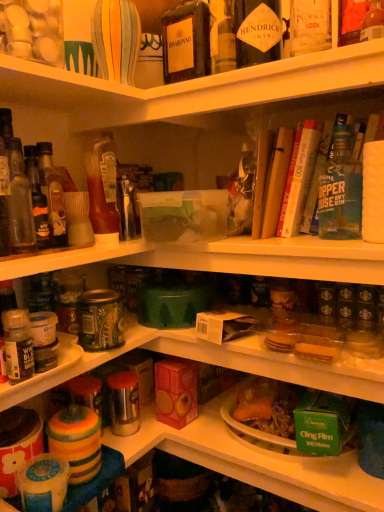
In order to face striped ceramic jar at lower left, should I rotate leftwards or rightwards?

You should rotate left by 15.316 degrees.

Where is `green matte bottle at upper right, marked as the 7th bottle in a left-to-right arrangement`? This screenshot has width=384, height=512. green matte bottle at upper right, marked as the 7th bottle in a left-to-right arrangement is located at coordinates (340, 188).

The height and width of the screenshot is (512, 384). What do you see at coordinates (340, 188) in the screenshot?
I see `green matte bottle at upper right, marked as the 7th bottle in a left-to-right arrangement` at bounding box center [340, 188].

Describe the element at coordinates (276, 181) in the screenshot. The height and width of the screenshot is (512, 384). I see `yellow paperback book at upper right, positioned as the first book in left-to-right order` at that location.

This screenshot has width=384, height=512. In order to click on soy sauce glass at left, the fourth bottle when ordered from left to right in this screenshot , I will do `click(52, 194)`.

What do you see at coordinates (37, 198) in the screenshot?
I see `matte glass bottle at left, acting as the 6th bottle starting from the right` at bounding box center [37, 198].

Locate an element on the screen. The height and width of the screenshot is (512, 384). striped ceramic jar at lower left is located at coordinates (76, 441).

From a real-world perspective, is clear plastic container at upper center, acting as the first shelf starting from the right, located higher than hardcover book at upper right, the 2th book in the right-to-left sequence?

Indeed, from a real-world perspective, clear plastic container at upper center, acting as the first shelf starting from the right, stands above hardcover book at upper right, the 2th book in the right-to-left sequence.

Is clear plastic container at upper center, which is the 1th shelf in top-to-bottom order, oriented away from hardcover book at upper right, the 2th book in the right-to-left sequence?

No, hardcover book at upper right, the 2th book in the right-to-left sequence, is not at the back of clear plastic container at upper center, which is the 1th shelf in top-to-bottom order.

Considering the positions of objects clear plastic container at upper center, which is the 1th shelf in top-to-bottom order, and hardcover book at upper right, the 2th book in the right-to-left sequence, in the image provided, who is more to the left, clear plastic container at upper center, which is the 1th shelf in top-to-bottom order, or hardcover book at upper right, the 2th book in the right-to-left sequence,?

From the viewer's perspective, clear plastic container at upper center, which is the 1th shelf in top-to-bottom order, appears more on the left side.

What are the coordinates of `the 2nd book below the clear plastic container at upper center, marked as the second shelf in a left-to-right arrangement (from the image's perspective)` in the screenshot? It's located at (299, 177).

From the picture: Is the position of translucent glass bottle at upper left, the fifth bottle positioned from the left, more distant than that of clear plastic container at upper center, which is the 1th shelf in top-to-bottom order?

Yes, the depth of translucent glass bottle at upper left, the fifth bottle positioned from the left, is greater than that of clear plastic container at upper center, which is the 1th shelf in top-to-bottom order.

From the image's perspective, is translucent glass bottle at upper left, the fifth bottle positioned from the left, on clear plastic container at upper center, which is the 1th shelf in top-to-bottom order?

No.

What's the angular difference between translucent glass bottle at upper left, the 3th bottle in the right-to-left sequence, and clear plastic container at upper center, which is the 1th shelf in top-to-bottom order,'s facing directions?

There is a 91.4-degree angle between the facing directions of translucent glass bottle at upper left, the 3th bottle in the right-to-left sequence, and clear plastic container at upper center, which is the 1th shelf in top-to-bottom order.

Does translucent glass bottle at upper left, the 3th bottle in the right-to-left sequence, have a lesser width compared to clear plastic container at upper center, acting as the first shelf starting from the right?

Yes.

Considering the points (199, 39) and (302, 176), which point is behind, point (199, 39) or point (302, 176)?

Point (199, 39)

Does dark brown glass bottle at upper center, which appears as the 6th bottle when viewed from the left, turn towards hardcover book at upper right, arranged as the 2th book when viewed from the left?

No, dark brown glass bottle at upper center, which appears as the 6th bottle when viewed from the left, is not facing towards hardcover book at upper right, arranged as the 2th book when viewed from the left.

This screenshot has width=384, height=512. I want to click on bottle that appears above the hardcover book at upper right, the 2th book in the right-to-left sequence (from the image's perspective), so click(186, 41).

From the image's perspective, which is below, dark brown glass bottle at upper center, which ranks as the second bottle in right-to-left order, or matte glass bottle at left, the 2th bottle viewed from the left?

matte glass bottle at left, the 2th bottle viewed from the left, is shown below in the image.

Is dark brown glass bottle at upper center, which appears as the 6th bottle when viewed from the left, outside of matte glass bottle at left, the 2th bottle viewed from the left?

That's correct, dark brown glass bottle at upper center, which appears as the 6th bottle when viewed from the left, is outside of matte glass bottle at left, the 2th bottle viewed from the left.

At what (x,y) coordinates should I click in order to perform the action: click on the 5th bottle positioned below the dark brown glass bottle at upper center, which ranks as the second bottle in right-to-left order (from a real-world perspective). Please return your answer as a coordinate pair (x, y). The height and width of the screenshot is (512, 384). Looking at the image, I should click on pyautogui.click(x=37, y=198).

Between point (76, 341) and point (344, 208), which one is positioned behind?

Point (76, 341)

Consider the image. Can you confirm if metallic silver canister at left, the 2th shelf viewed from the top, is smaller than green matte bottle at upper right, the 1th bottle viewed from the right?

No, metallic silver canister at left, the 2th shelf viewed from the top, is not smaller than green matte bottle at upper right, the 1th bottle viewed from the right.

The width and height of the screenshot is (384, 512). Find the location of `the 6th bottle located above the metallic silver canister at left, acting as the 1th shelf starting from the left (from a real-world perspective)`. the 6th bottle located above the metallic silver canister at left, acting as the 1th shelf starting from the left (from a real-world perspective) is located at coordinates (340, 188).

From the image's perspective, is matte glass bottle at left, the 2th bottle viewed from the left, below striped ceramic jar at lower left?

No, from the image's perspective, matte glass bottle at left, the 2th bottle viewed from the left, is not below striped ceramic jar at lower left.

Does matte glass bottle at left, the 2th bottle viewed from the left, have a greater width compared to striped ceramic jar at lower left?

No.

From a real-world perspective, is matte glass bottle at left, the 2th bottle viewed from the left, positioned above or below striped ceramic jar at lower left?

matte glass bottle at left, the 2th bottle viewed from the left, is above striped ceramic jar at lower left.

Can you confirm if matte glass bottle at left, the 2th bottle viewed from the left, is smaller than striped ceramic jar at lower left?

Yes.

Is green matte bottle at upper right, marked as the 7th bottle in a left-to-right arrangement, taller or shorter than dark brown glass bottle at upper center, which appears as the 6th bottle when viewed from the left?

Clearly, green matte bottle at upper right, marked as the 7th bottle in a left-to-right arrangement, is shorter compared to dark brown glass bottle at upper center, which appears as the 6th bottle when viewed from the left.

From the image's perspective, is green matte bottle at upper right, the 1th bottle viewed from the right, on dark brown glass bottle at upper center, which ranks as the second bottle in right-to-left order?

No, from the image's perspective, green matte bottle at upper right, the 1th bottle viewed from the right, is not on top of dark brown glass bottle at upper center, which ranks as the second bottle in right-to-left order.

Is there a large distance between green matte bottle at upper right, marked as the 7th bottle in a left-to-right arrangement, and dark brown glass bottle at upper center, which ranks as the second bottle in right-to-left order?

That's not correct — green matte bottle at upper right, marked as the 7th bottle in a left-to-right arrangement, is a little close to dark brown glass bottle at upper center, which ranks as the second bottle in right-to-left order.

Does green matte bottle at upper right, the 1th bottle viewed from the right, lie in front of dark brown glass bottle at upper center, which appears as the 6th bottle when viewed from the left?

Yes, it is in front of dark brown glass bottle at upper center, which appears as the 6th bottle when viewed from the left.

Where is `the 2nd book behind the clear plastic container at upper center, marked as the second shelf in a left-to-right arrangement, counting from the anchor's position`? The image size is (384, 512). the 2nd book behind the clear plastic container at upper center, marked as the second shelf in a left-to-right arrangement, counting from the anchor's position is located at coordinates (299, 177).

This screenshot has height=512, width=384. I want to click on shelf that appears above the translucent glass bottle at upper left, the fifth bottle positioned from the left (from the image's perspective), so click(192, 86).

Looking at the image, which one is located further to dark brown glass bottle at upper center, which appears as the 6th bottle when viewed from the left, green matte bottle at upper right, the 1th bottle viewed from the right, or translucent glass bottle at left, the 7th bottle from the right?

translucent glass bottle at left, the 7th bottle from the right, lies further to dark brown glass bottle at upper center, which appears as the 6th bottle when viewed from the left, than the other object.

Estimate the real-world distances between objects in this image. Which object is closer to translucent glass bottle at left, the 7th bottle from the right, dark brown glass bottle at upper center, which ranks as the second bottle in right-to-left order, or striped ceramic jar at lower left?

Among the two, striped ceramic jar at lower left is located nearer to translucent glass bottle at left, the 7th bottle from the right.

From the image, which object appears to be nearer to translucent glass bottle at left, the 1th bottle in the left-to-right sequence, hardcover book at upper right, arranged as the 2th book when viewed from the left, or translucent plastic bottle at lower left, placed as the fifth bottle when sorted from right to left?

Among the two, translucent plastic bottle at lower left, placed as the fifth bottle when sorted from right to left, is located nearer to translucent glass bottle at left, the 1th bottle in the left-to-right sequence.

Which object lies nearer to the anchor point dark brown glass bottle at upper center, which appears as the 6th bottle when viewed from the left, hardcover book at upper right, placed as the first book when sorted from right to left, or matte glass bottle at left, acting as the 6th bottle starting from the right?

The object closer to dark brown glass bottle at upper center, which appears as the 6th bottle when viewed from the left, is hardcover book at upper right, placed as the first book when sorted from right to left.

Estimate the real-world distances between objects in this image. Which object is further from striped ceramic jar at lower left, dark brown glass bottle at upper center, which ranks as the second bottle in right-to-left order, or hardcover book at upper right, the 3th book positioned from the left?

Among the two, dark brown glass bottle at upper center, which ranks as the second bottle in right-to-left order, is located further to striped ceramic jar at lower left.

Which object lies further to the anchor point translucent plastic bottle at lower left, the third bottle from the left, hardcover book at upper right, the 2th book in the right-to-left sequence, or green matte bottle at upper right, marked as the 7th bottle in a left-to-right arrangement?

Based on the image, green matte bottle at upper right, marked as the 7th bottle in a left-to-right arrangement, appears to be further to translucent plastic bottle at lower left, the third bottle from the left.

From the image, which object appears to be farther from clear plastic container at upper center, positioned as the 2th shelf in bottom-to-top order, green matte bottle at upper right, the 1th bottle viewed from the right, or soy sauce glass at left, the fourth bottle when ordered from left to right?

green matte bottle at upper right, the 1th bottle viewed from the right, is further to clear plastic container at upper center, positioned as the 2th shelf in bottom-to-top order.

Based on their spatial positions, is metallic silver canister at left, acting as the 1th shelf starting from the left, or translucent plastic bottle at lower left, placed as the fifth bottle when sorted from right to left, closer to clear plastic container at upper center, marked as the second shelf in a left-to-right arrangement?

The object closer to clear plastic container at upper center, marked as the second shelf in a left-to-right arrangement, is translucent plastic bottle at lower left, placed as the fifth bottle when sorted from right to left.

Where is `food situated between translucent glass bottle at left, the 7th bottle from the right, and green matte bottle at upper right, the 1th bottle viewed from the right, from left to right`? food situated between translucent glass bottle at left, the 7th bottle from the right, and green matte bottle at upper right, the 1th bottle viewed from the right, from left to right is located at coordinates (76, 441).

The image size is (384, 512). In order to click on shelf located between matte glass bottle at left, acting as the 6th bottle starting from the right, and yellow paperback book at upper right, positioned as the first book in left-to-right order, in the left-right direction in this screenshot , I will do `click(192, 86)`.

You are a GUI agent. You are given a task and a screenshot of the screen. Output one action in this format:
    pyautogui.click(x=<x>, y=<y>)
    Task: Click on the shelf between metallic silver canister at left, the second shelf when ordered from right to left, and yellow paperback book at upper right, marked as the 3th book in a right-to-left arrangement, in the horizontal direction
    
    Given the screenshot: What is the action you would take?
    pyautogui.click(x=192, y=86)

The height and width of the screenshot is (512, 384). Identify the location of shelf between translucent glass bottle at left, the 7th bottle from the right, and hardcover book at upper right, the 3th book positioned from the left. (192, 86).